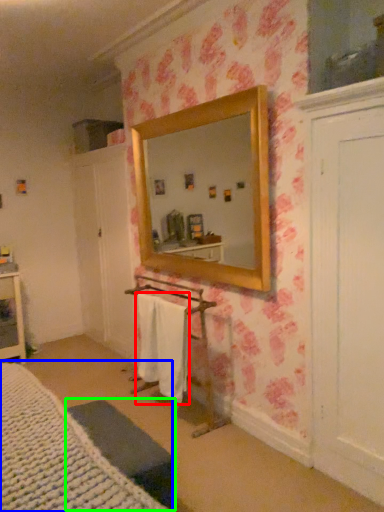
Question: Estimate the real-world distances between objects in this image. Which object is closer to bath towel (highlighted by a red box), bed (highlighted by a blue box) or furniture (highlighted by a green box)?

Choices:
 (A) bed
 (B) furniture

Answer: (B)